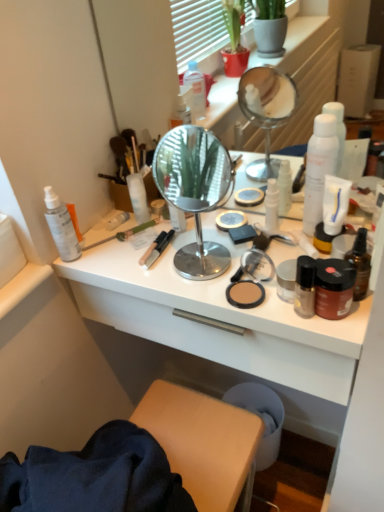
In order to click on vacant space that's between clear plastic tube at center, the third toiletry in the left-to-right sequence, and white glossy bottle at center, which is the 4th toiletry in right-to-left order in this screenshot , I will do `click(192, 226)`.